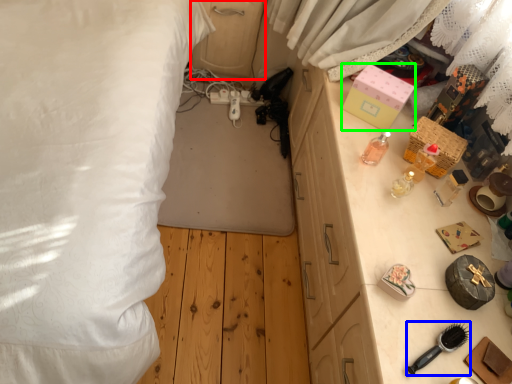
Question: Based on their relative distances, which object is nearer to dresser (highlighted by a red box)? Choose from brush (highlighted by a blue box) and box (highlighted by a green box).

Choices:
 (A) brush
 (B) box

Answer: (B)